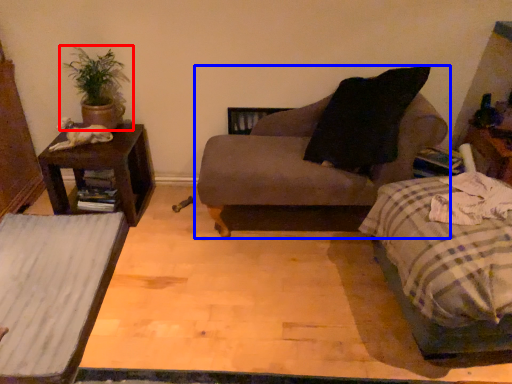
Question: Among these objects, which one is nearest to the camera, houseplant (highlighted by a red box) or chair (highlighted by a blue box)?

Choices:
 (A) houseplant
 (B) chair

Answer: (B)